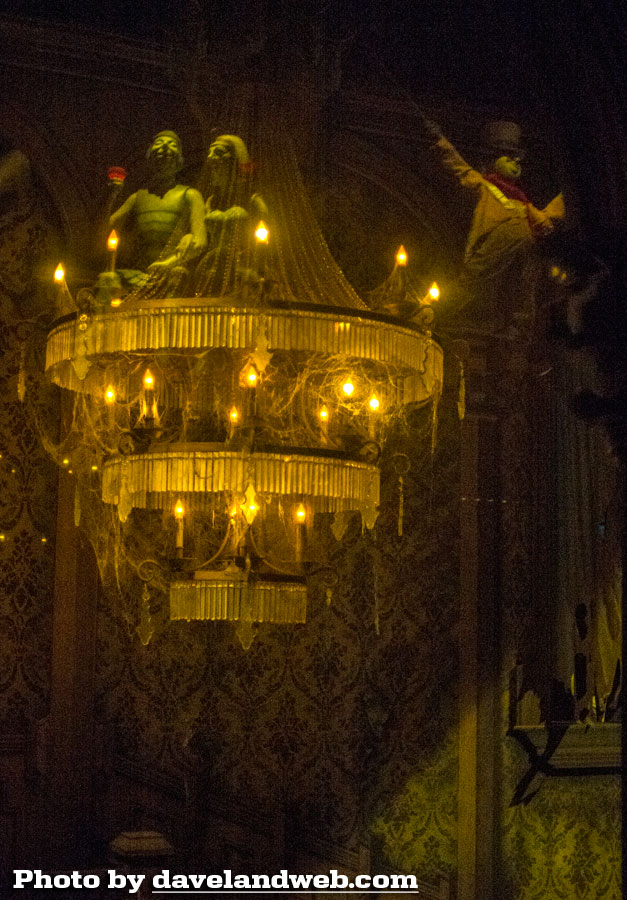
Find the location of a particular element. This screenshot has width=627, height=900. wall is located at coordinates (345, 739).